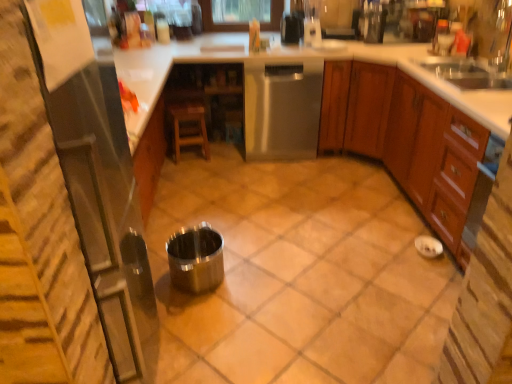
Image resolution: width=512 pixels, height=384 pixels. In order to click on metallic stainless steel coffee maker at upper center, arranged as the 3th appliance when viewed from the back in this screenshot , I will do `click(292, 28)`.

The image size is (512, 384). I want to click on brown wood cabinet at right, so click(x=405, y=140).

Based on the photo, measure the distance between clear glass blender at upper center, the second appliance viewed from the right, and camera.

clear glass blender at upper center, the second appliance viewed from the right, and camera are 3.29 meters apart.

I want to click on stainless steel dishwasher at center, so click(282, 109).

Where is `metallic stainless steel coffee maker at upper center, marked as the third appliance in a front-to-back arrangement`? This screenshot has height=384, width=512. metallic stainless steel coffee maker at upper center, marked as the third appliance in a front-to-back arrangement is located at coordinates (292, 28).

Is metallic stainless steel coffee maker at upper center, marked as the third appliance in a front-to-back arrangement, not near clear glass blender at upper center, arranged as the fifth appliance when ordered from the bottom?

metallic stainless steel coffee maker at upper center, marked as the third appliance in a front-to-back arrangement, is near clear glass blender at upper center, arranged as the fifth appliance when ordered from the bottom, not far away.

Does metallic stainless steel coffee maker at upper center, positioned as the third appliance in right-to-left order, appear on the left side of clear glass blender at upper center, the 4th appliance from the left?

Yes.

Is metallic stainless steel coffee maker at upper center, positioned as the third appliance in right-to-left order, positioned beyond the bounds of clear glass blender at upper center, which is the 1th appliance from top to bottom?

Absolutely, metallic stainless steel coffee maker at upper center, positioned as the third appliance in right-to-left order, is external to clear glass blender at upper center, which is the 1th appliance from top to bottom.

How distant is brown wood cabinet at right from clear glass blender at upper center, the 4th appliance from the left?

The distance of brown wood cabinet at right from clear glass blender at upper center, the 4th appliance from the left, is 38.48 inches.

Is brown wood cabinet at right to the left of clear glass blender at upper center, the 4th appliance from the left, from the viewer's perspective?

In fact, brown wood cabinet at right is to the right of clear glass blender at upper center, the 4th appliance from the left.

Could clear glass blender at upper center, marked as the 5th appliance in a front-to-back arrangement, be considered to be inside brown wood cabinet at right?

No, clear glass blender at upper center, marked as the 5th appliance in a front-to-back arrangement, is not a part of brown wood cabinet at right.

Is brown wood cabinet at right turned away from clear glass blender at upper center, the second appliance viewed from the right?

That's not correct — brown wood cabinet at right is not looking away from clear glass blender at upper center, the second appliance viewed from the right.

Identify the location of tile below the clear glass blender at upper center, which is the 1th appliance from top to bottom (from the image's perspective). (298, 275).

From a real-world perspective, is metallic silver at center located beneath clear glass blender at upper center, the 4th appliance from the left?

Yes.

Based on the photo, does metallic silver at center turn towards clear glass blender at upper center, positioned as the 1th appliance in back-to-front order?

No, metallic silver at center is not oriented towards clear glass blender at upper center, positioned as the 1th appliance in back-to-front order.

How different are the orientations of stainless steel trash can at center, the second appliance positioned from the bottom, and metallic silver at center in degrees?

stainless steel trash can at center, the second appliance positioned from the bottom, and metallic silver at center are facing 90 degrees away from each other.

From the image's perspective, does stainless steel trash can at center, which ranks as the fourth appliance in top-to-bottom order, appear higher than metallic silver at center?

No.

Does stainless steel trash can at center, the fifth appliance when ordered from right to left, turn towards metallic silver at center?

No, stainless steel trash can at center, the fifth appliance when ordered from right to left, is not aimed at metallic silver at center.

Is metallic stainless steel coffee maker at upper right, which is the 1th appliance from right to left, positioned in front of clear glass blender at upper center, positioned as the 1th appliance in back-to-front order?

Yes, it is.

Is metallic stainless steel coffee maker at upper right, which is the second appliance in top-to-bottom order, looking in the opposite direction of clear glass blender at upper center, arranged as the fifth appliance when ordered from the bottom?

No, metallic stainless steel coffee maker at upper right, which is the second appliance in top-to-bottom order,'s orientation is not away from clear glass blender at upper center, arranged as the fifth appliance when ordered from the bottom.

Choose the correct answer: Is metallic stainless steel coffee maker at upper right, marked as the 5th appliance in a left-to-right arrangement, inside clear glass blender at upper center, the second appliance viewed from the right, or outside it?

The correct answer is: outside.

Are metallic stainless steel coffee maker at upper right, arranged as the fourth appliance when viewed from the front, and clear glass blender at upper center, the second appliance viewed from the right, making contact?

No, metallic stainless steel coffee maker at upper right, arranged as the fourth appliance when viewed from the front, is not in contact with clear glass blender at upper center, the second appliance viewed from the right.

From a real-world perspective, starting from the metallic silver at center, which appliance is the 3rd one vertically above it? Please provide its 2D coordinates.

[(292, 28)]

From the image's perspective, is metallic silver at center located above metallic stainless steel coffee maker at upper center, arranged as the 3th appliance when viewed from the back?

No, from the image's perspective, metallic silver at center is not on top of metallic stainless steel coffee maker at upper center, arranged as the 3th appliance when viewed from the back.

Could you tell me if metallic silver at center is facing metallic stainless steel coffee maker at upper center, marked as the third appliance in a front-to-back arrangement?

No.

Can you confirm if metallic silver at center is positioned to the right of metallic stainless steel coffee maker at upper center, which is the third appliance in bottom-to-top order?

No.

Is brown wood cabinet at right situated inside metallic silver at center or outside?

brown wood cabinet at right is not enclosed by metallic silver at center.

From a real-world perspective, is brown wood cabinet at right positioned above or below metallic silver at center?

From a real-world perspective, brown wood cabinet at right is physically above metallic silver at center.

Who is taller, brown wood cabinet at right or metallic silver at center?

With more height is brown wood cabinet at right.

Which object is closer to the camera taking this photo, brown wood cabinet at right or metallic silver at center?

metallic silver at center is more forward.

Identify the location of the 2nd appliance in front of the clear glass blender at upper center, the 4th appliance from the left. (292, 28).

Where is `the 2nd appliance counting from the left of the brown wood cabinet at right`? This screenshot has width=512, height=384. the 2nd appliance counting from the left of the brown wood cabinet at right is located at coordinates (312, 23).

Estimate the real-world distances between objects in this image. Which object is further from clear glass blender at upper center, the second appliance viewed from the right, stainless steel trash can at center, the second appliance positioned from the bottom, or stainless steel dishwasher at center?

Based on the image, stainless steel trash can at center, the second appliance positioned from the bottom, appears to be further to clear glass blender at upper center, the second appliance viewed from the right.

Considering their positions, is wooden stool at center positioned further to brown wood cabinet at right than stainless steel trash can at center, the fifth appliance when ordered from right to left?

stainless steel trash can at center, the fifth appliance when ordered from right to left, is positioned further to the anchor brown wood cabinet at right.

Based on their spatial positions, is stainless steel trash can at center, the second appliance positioned from the bottom, or clear glass blender at upper center, marked as the 5th appliance in a front-to-back arrangement, further from brown wood cabinet at right?

stainless steel trash can at center, the second appliance positioned from the bottom, is further to brown wood cabinet at right.

Looking at the image, which one is located closer to clear glass blender at upper center, the 4th appliance from the left, metallic silver at center or polished metallic cup at center, the fourth appliance from the back?

Based on the image, metallic silver at center appears to be nearer to clear glass blender at upper center, the 4th appliance from the left.

Looking at the image, which one is located closer to metallic silver at center, stainless steel dishwasher at center or wooden stool at center?

stainless steel dishwasher at center is closer to metallic silver at center.

When comparing their distances from brown wood cabinet at right, does polished metallic cup at center, placed as the 2th appliance when sorted from left to right, or stainless steel trash can at center, the fifth appliance when ordered from right to left, seem closer?

The object closer to brown wood cabinet at right is polished metallic cup at center, placed as the 2th appliance when sorted from left to right.

Estimate the real-world distances between objects in this image. Which object is closer to metallic stainless steel coffee maker at upper right, which is the second appliance in top-to-bottom order, wooden stool at center or metallic stainless steel coffee maker at upper center, positioned as the 3th appliance in left-to-right order?

metallic stainless steel coffee maker at upper center, positioned as the 3th appliance in left-to-right order.

From the image, which object appears to be farther from stainless steel trash can at center, the first appliance from the left, metallic silver at center or wooden stool at center?

Based on the image, wooden stool at center appears to be further to stainless steel trash can at center, the first appliance from the left.

Identify the location of appliance positioned between stainless steel trash can at center, the 5th appliance from the back, and metallic stainless steel coffee maker at upper center, positioned as the third appliance in right-to-left order, from near to far. The height and width of the screenshot is (384, 512). (196, 259).

This screenshot has width=512, height=384. I want to click on appliance between metallic stainless steel coffee maker at upper center, positioned as the third appliance in right-to-left order, and metallic stainless steel coffee maker at upper right, which is counted as the 4th appliance, starting from the bottom, so click(312, 23).

At what (x,y) coordinates should I click in order to perform the action: click on tile between metallic stainless steel coffee maker at upper center, arranged as the 3th appliance when viewed from the back, and polished metallic cup at center, the fourth appliance from the back, in the vertical direction. Please return your answer as a coordinate pair (x, y). The image size is (512, 384). Looking at the image, I should click on (298, 275).

You are a GUI agent. You are given a task and a screenshot of the screen. Output one action in this format:
    pyautogui.click(x=<x>, y=<y>)
    Task: Click on the stool between clear glass blender at upper center, marked as the 5th appliance in a front-to-back arrangement, and polished metallic cup at center, placed as the 2th appliance when sorted from left to right, from top to bottom
    Image resolution: width=512 pixels, height=384 pixels.
    Given the screenshot: What is the action you would take?
    pos(188,127)